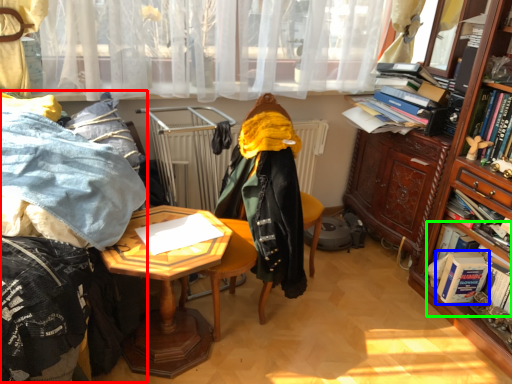
Question: Based on their relative distances, which object is nearer to bedding (highlighted by a red box)? Choose from book (highlighted by a blue box) and book (highlighted by a green box).

Choices:
 (A) book
 (B) book

Answer: (B)